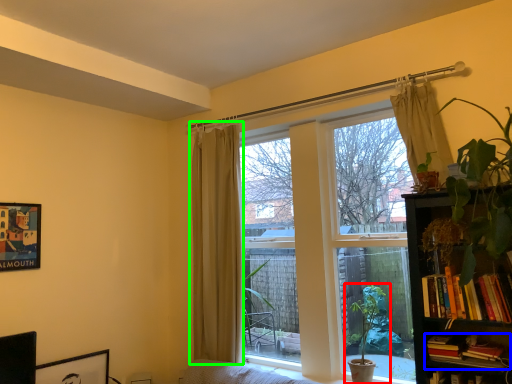
Question: Which object is positioned closest to houseplant (highlighted by a red box)? Select from book (highlighted by a blue box) and curtain (highlighted by a green box).

Choices:
 (A) book
 (B) curtain

Answer: (A)